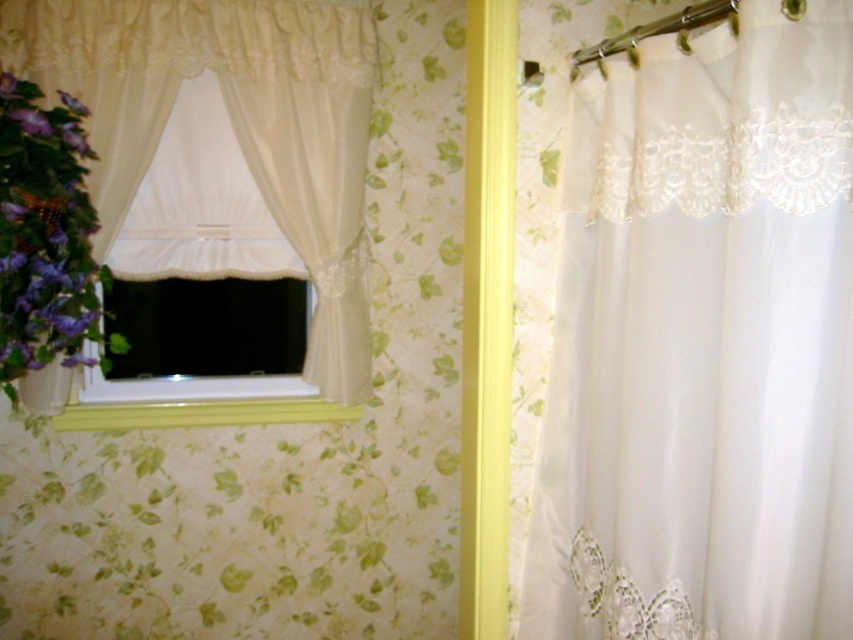
In the scene shown: Which is more to the left, white sheer fabric at right or yellow painted wood at lower center?

Positioned to the left is yellow painted wood at lower center.

Measure the distance between white sheer fabric at right and camera.

white sheer fabric at right and camera are 30.61 inches apart from each other.

Where is `white sheer fabric at right`? This screenshot has width=853, height=640. white sheer fabric at right is located at coordinates (701, 342).

Between white sheer fabric at right and white lace curtain at left, which one appears on the left side from the viewer's perspective?

white lace curtain at left

Find the location of a particular element. white sheer fabric at right is located at coordinates (701, 342).

Does white lace curtain at left appear over purple matte flower at left?

Correct, white lace curtain at left is located above purple matte flower at left.

Can you confirm if white lace curtain at left is thinner than purple matte flower at left?

No.

Locate an element on the screen. The width and height of the screenshot is (853, 640). white lace curtain at left is located at coordinates (231, 124).